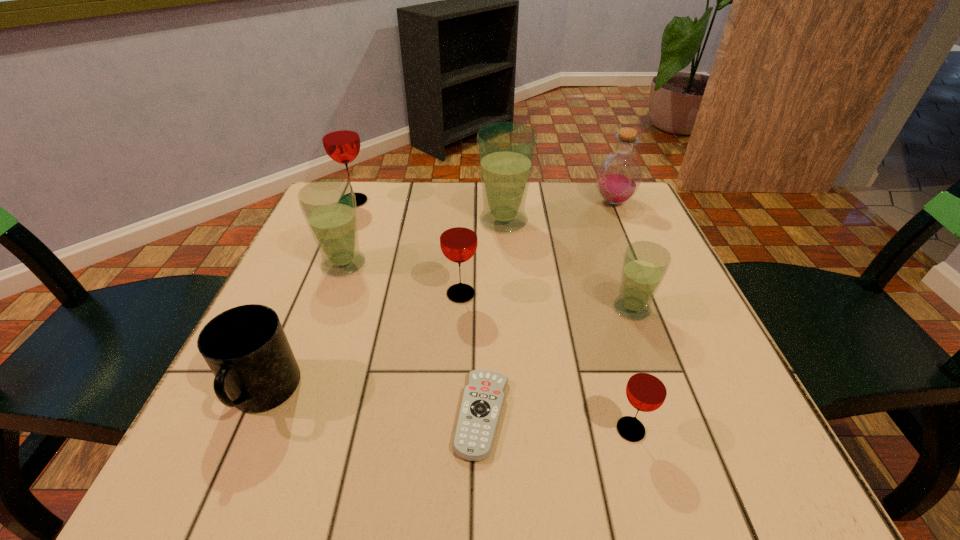
Locate an element on the screen. glass located in the right edge section of the desktop is located at coordinates (645, 264).

Locate an element on the screen. This screenshot has width=960, height=540. object that is at the far left corner is located at coordinates (340, 137).

The height and width of the screenshot is (540, 960). In order to click on object at the near left corner in this screenshot , I will do `click(246, 348)`.

Where is `object that is at the far right corner`? The width and height of the screenshot is (960, 540). object that is at the far right corner is located at coordinates (619, 175).

I want to click on vacant space at the far edge of the desktop, so click(x=387, y=194).

In the image, there is a desktop. Where is `vacant space at the near edge`? This screenshot has width=960, height=540. vacant space at the near edge is located at coordinates (495, 461).

Locate an element on the screen. This screenshot has width=960, height=540. free space at the left edge of the desktop is located at coordinates (308, 268).

Where is `blank space at the right edge of the desktop`? blank space at the right edge of the desktop is located at coordinates (686, 297).

The height and width of the screenshot is (540, 960). Identify the location of free space between the farthest blue glass and the biggest red glass. (429, 211).

Identify the location of vacant area between the nearest blue glass and the second red glass from right to left. (546, 301).